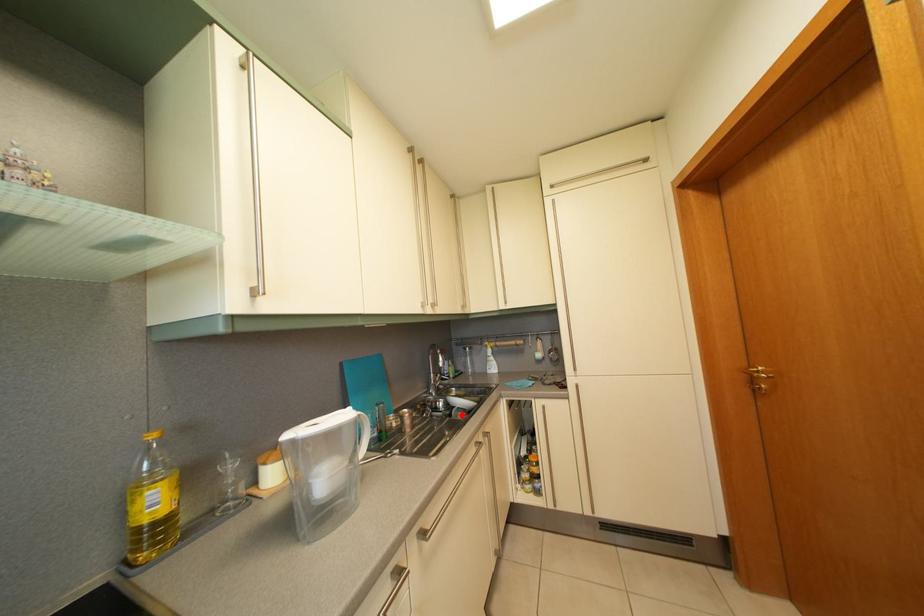
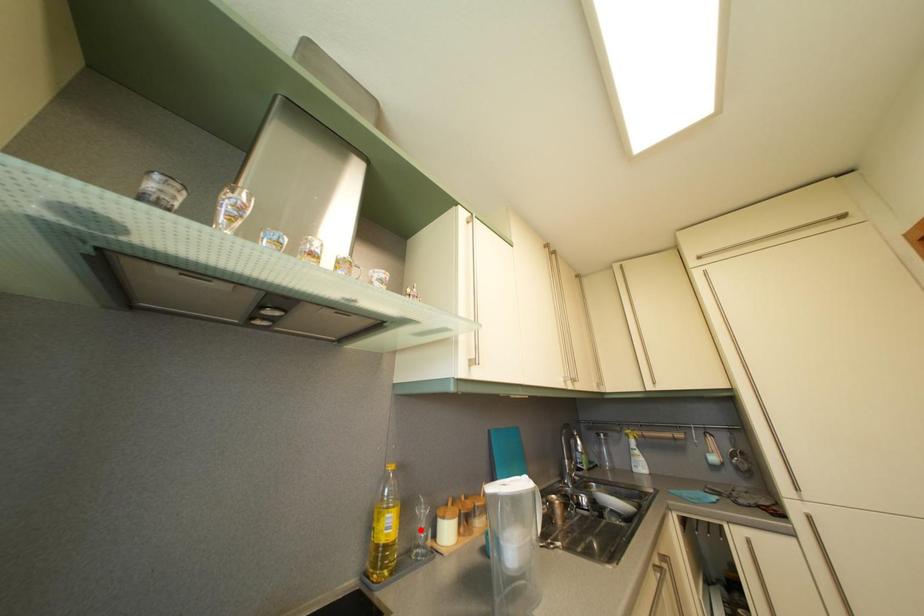
I am providing you with two images of the same scene from different viewpoints. A red point is marked on the first image and another point is marked on the second image. Does the point marked in image1 correspond to the same location as the one in image2?

No